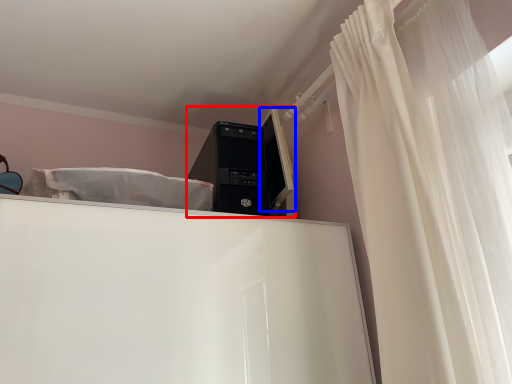
Question: Which point is closer to the camera, desktop computer (highlighted by a red box) or computer monitor (highlighted by a blue box)?

Choices:
 (A) desktop computer
 (B) computer monitor

Answer: (A)